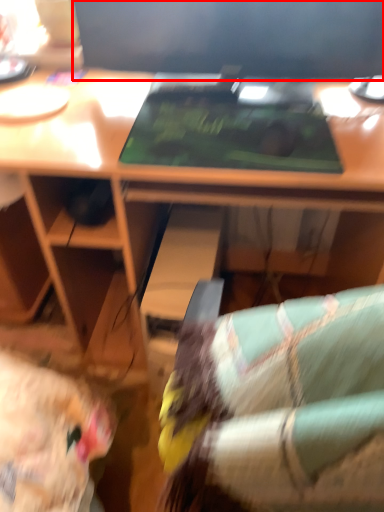
Question: From the image's perspective, what is the correct spatial positioning of computer monitor (annotated by the red box) in reference to laptop?

Choices:
 (A) above
 (B) below

Answer: (A)